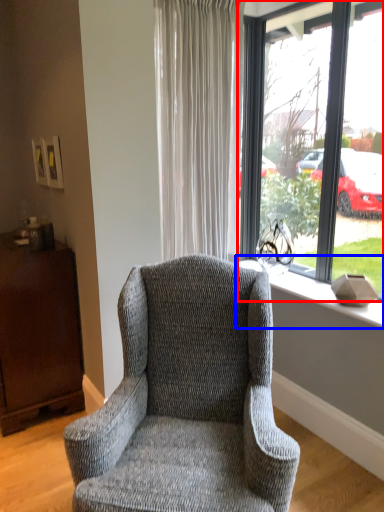
Question: Which object appears farthest to the camera in this image, window (highlighted by a red box) or window sill (highlighted by a blue box)?

Choices:
 (A) window
 (B) window sill

Answer: (B)